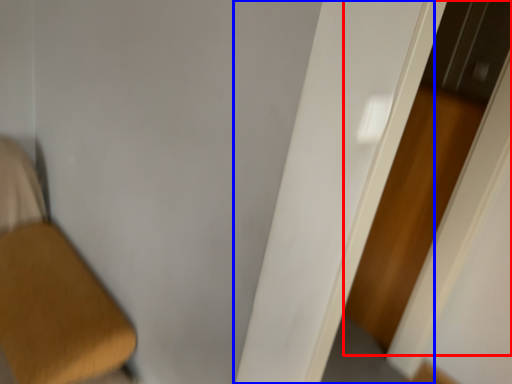
Question: Which point is closer to the camera, screen door (highlighted by a red box) or door (highlighted by a blue box)?

Choices:
 (A) screen door
 (B) door

Answer: (B)